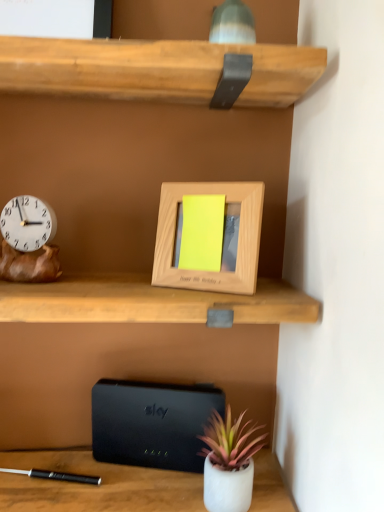
Question: Should I look upward or downward to see wooden photo frame at center?

Choices:
 (A) down
 (B) up

Answer: (B)

Question: Is wooden photo frame at center not near wooden clock at left?

Choices:
 (A) no
 (B) yes

Answer: (A)

Question: Is wooden photo frame at center taller than wooden clock at left?

Choices:
 (A) no
 (B) yes

Answer: (B)

Question: From the image's perspective, is wooden photo frame at center beneath wooden clock at left?

Choices:
 (A) yes
 (B) no

Answer: (B)

Question: Considering the relative sizes of wooden photo frame at center and wooden clock at left in the image provided, is wooden photo frame at center bigger than wooden clock at left?

Choices:
 (A) no
 (B) yes

Answer: (B)

Question: Is wooden photo frame at center completely or partially outside of wooden clock at left?

Choices:
 (A) no
 (B) yes

Answer: (B)

Question: Does wooden photo frame at center contain wooden clock at left?

Choices:
 (A) no
 (B) yes

Answer: (A)

Question: Can you confirm if wooden photo frame at center is smaller than black matte/black plastic at lower center?

Choices:
 (A) yes
 (B) no

Answer: (B)

Question: Would you say black matte/black plastic at lower center is part of wooden photo frame at center's contents?

Choices:
 (A) yes
 (B) no

Answer: (B)

Question: Are wooden photo frame at center and black matte/black plastic at lower center making contact?

Choices:
 (A) yes
 (B) no

Answer: (B)

Question: From a real-world perspective, is wooden photo frame at center located beneath black matte/black plastic at lower center?

Choices:
 (A) yes
 (B) no

Answer: (B)

Question: From a real-world perspective, is wooden photo frame at center over black matte/black plastic at lower center?

Choices:
 (A) yes
 (B) no

Answer: (A)

Question: Is wooden photo frame at center to the left of black matte/black plastic at lower center from the viewer's perspective?

Choices:
 (A) no
 (B) yes

Answer: (A)

Question: From the image's perspective, is matte white pot at lower center over black matte/black plastic at lower center?

Choices:
 (A) no
 (B) yes

Answer: (A)